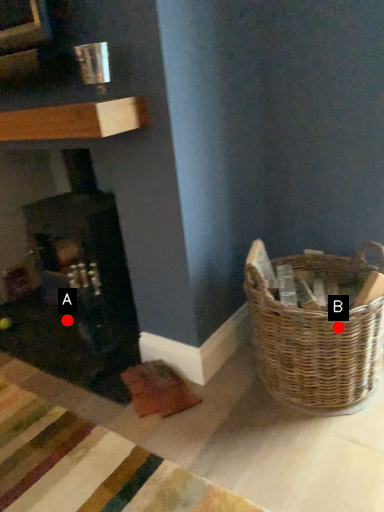
Question: Two points are circled on the image, labeled by A and B beside each circle. Among these points, which one is farthest from the camera?

Choices:
 (A) A is further
 (B) B is further

Answer: (A)